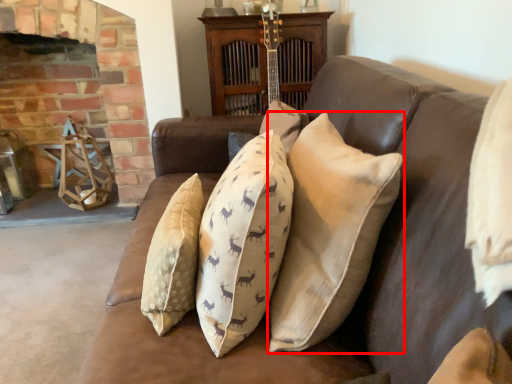
Question: From the image's perspective, where is pillow (annotated by the red box) located relative to fireplace?

Choices:
 (A) above
 (B) below

Answer: (B)